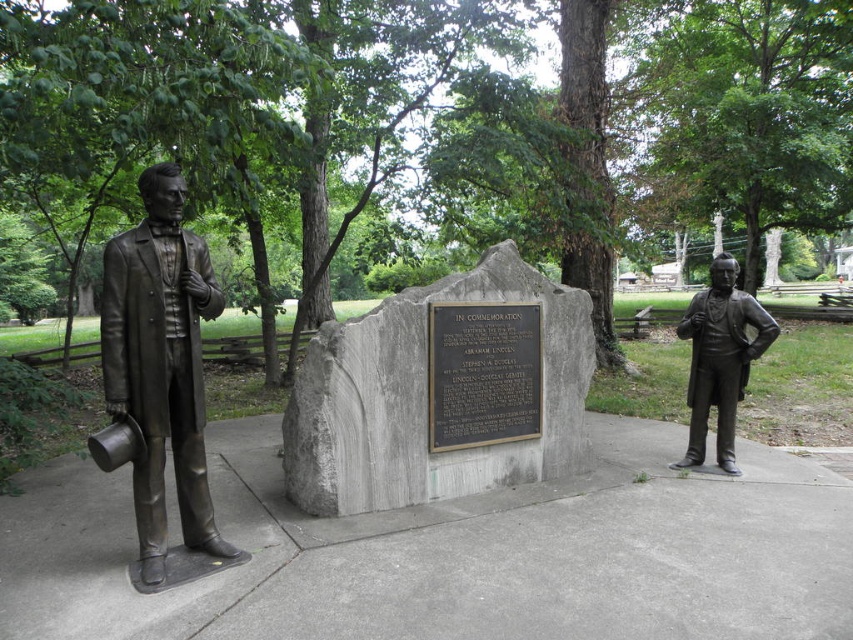
Is gray stone plaque at center wider than bronze statue at left?

Yes.

Who is positioned more to the left, gray stone plaque at center or bronze statue at left?

Positioned to the left is bronze statue at left.

Find the location of `gray stone plaque at center`. gray stone plaque at center is located at coordinates (426, 400).

Does gray stone plaque at center appear over black polished stone plaque at center?

Actually, gray stone plaque at center is below black polished stone plaque at center.

Who is more forward, (581, 467) or (529, 349)?

Positioned in front is point (529, 349).

Which is in front, point (560, 401) or point (488, 333)?

Point (488, 333) is in front.

The height and width of the screenshot is (640, 853). I want to click on gray stone plaque at center, so click(426, 400).

Between black polished stone plaque at center and bronze statue at right, which one has more height?

bronze statue at right is taller.

This screenshot has height=640, width=853. Describe the element at coordinates (483, 372) in the screenshot. I see `black polished stone plaque at center` at that location.

This screenshot has width=853, height=640. What are the coordinates of `black polished stone plaque at center` in the screenshot? It's located at (483, 372).